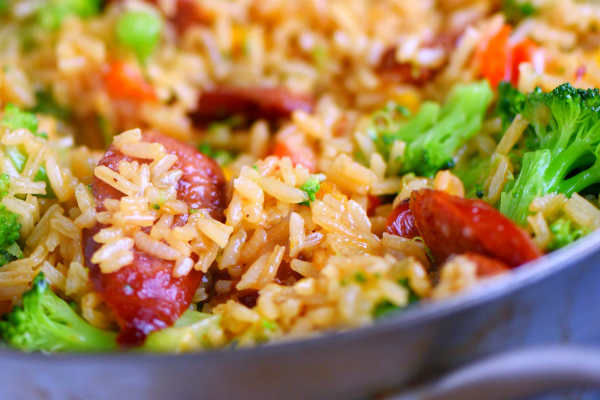
Where is `bowl`? The image size is (600, 400). bowl is located at coordinates pyautogui.click(x=104, y=375).